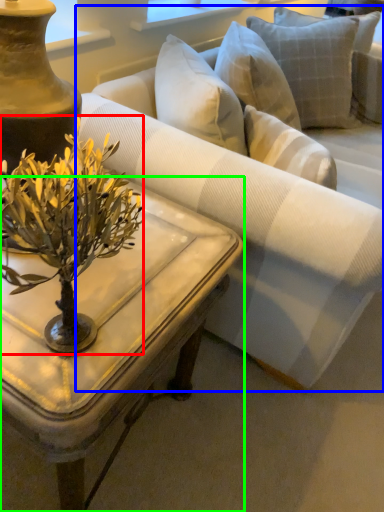
Question: Which object is the closest to the flower (highlighted by a red box)? Choose among these: studio couch (highlighted by a blue box) or coffee table (highlighted by a green box).

Choices:
 (A) studio couch
 (B) coffee table

Answer: (B)